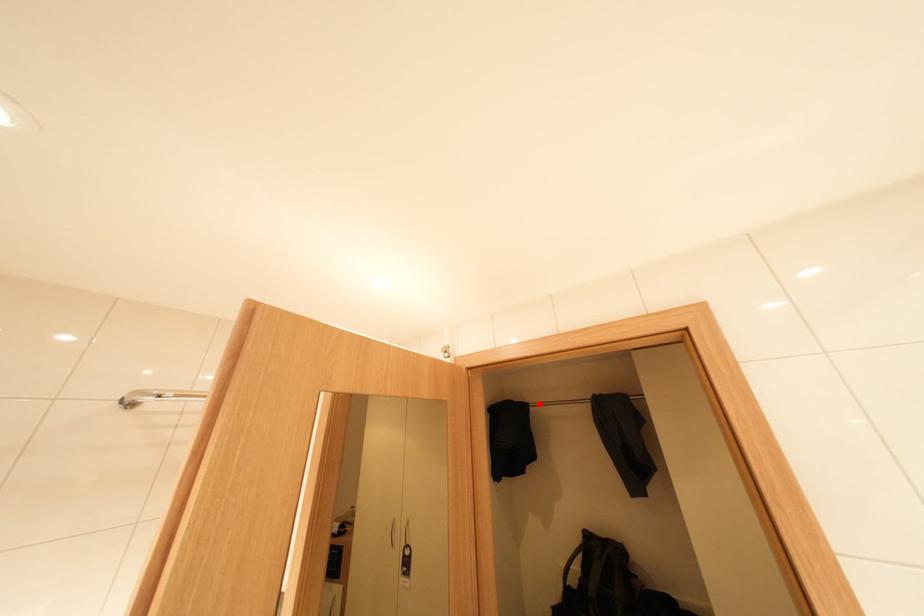
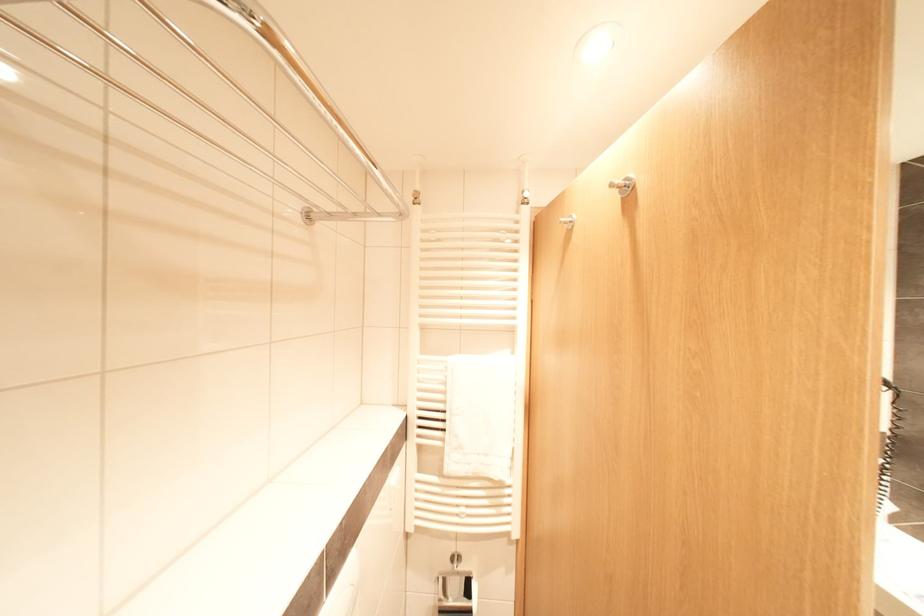
Question: I am providing you with two images of the same scene from different viewpoints. A red point is marked on the first image. Is the red point's position out of view in image 2?

Choices:
 (A) Yes
 (B) No

Answer: (A)